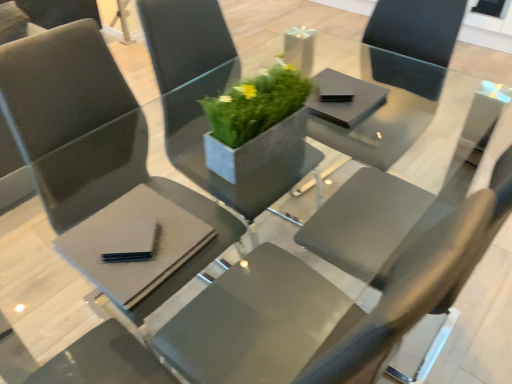
Question: Is matte gray chair at center, placed as the first chair when sorted from right to left, bigger or smaller than matte black table at center?

Choices:
 (A) small
 (B) big

Answer: (B)

Question: Which is correct: matte gray chair at center, placed as the first chair when sorted from right to left, is inside matte black table at center, or outside of it?

Choices:
 (A) outside
 (B) inside

Answer: (A)

Question: Considering the real-world distances, which object is farthest from the matte gray chair at center, placed as the first chair when sorted from right to left?

Choices:
 (A) matte gray chair at center, placed as the 1th chair when sorted from left to right
 (B) black matte napkin at center, the 1th pad from the top
 (C) green concrete planter at center
 (D) black matte pad at lower left, marked as the 2th pad in a top-to-bottom arrangement
 (E) matte black table at center

Answer: (E)

Question: Based on their relative distances, which object is farther from the green concrete planter at center?

Choices:
 (A) matte black table at center
 (B) matte gray chair at center, the 2th chair from the left
 (C) black matte pad at lower left, the second pad in the back-to-front sequence
 (D) black matte napkin at center, the 1th pad from the back
 (E) matte gray chair at center, placed as the 1th chair when sorted from left to right

Answer: (A)